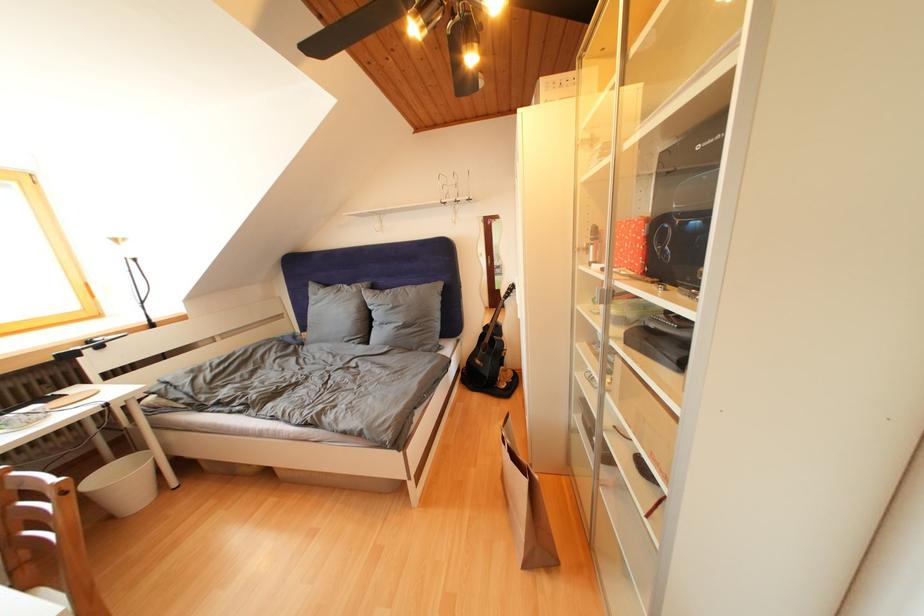
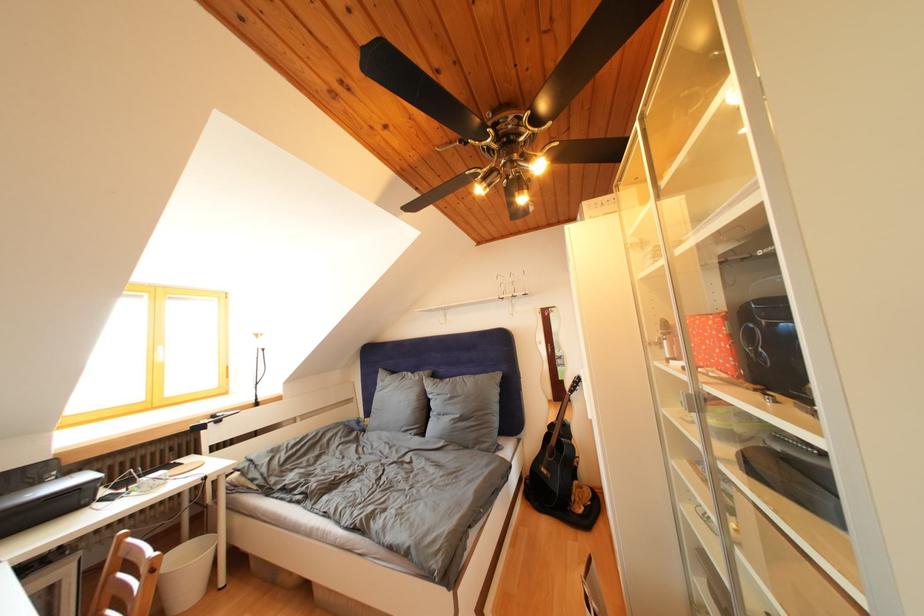
Question: The images are taken continuously from a first-person perspective. In which direction are you moving?

Choices:
 (A) Left
 (B) Right
 (C) Forward
 (D) Backward

Answer: (D)